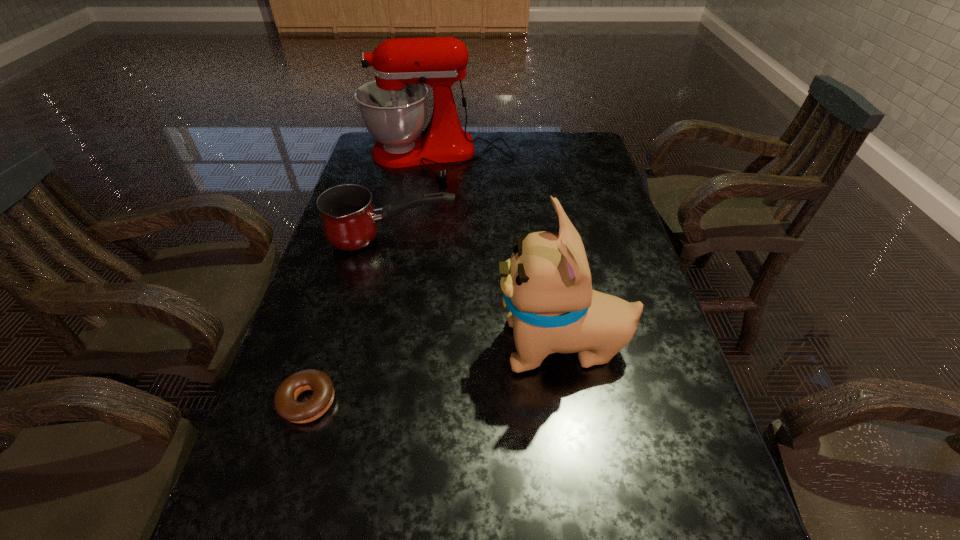
At what (x,y) coordinates should I click in order to perform the action: click on the farthest object. Please return your answer as a coordinate pair (x, y). The height and width of the screenshot is (540, 960). Looking at the image, I should click on pos(393,108).

In order to click on puppy in this screenshot , I will do `click(547, 287)`.

Locate an element on the screen. The height and width of the screenshot is (540, 960). the third tallest object is located at coordinates (350, 223).

Image resolution: width=960 pixels, height=540 pixels. Identify the location of saucepan. (350, 223).

Identify the location of doughnut. [x=286, y=406].

In order to click on vacant position located on the bowl side of the farthest object in this screenshot , I will do `click(423, 261)`.

Locate an element on the screen. This screenshot has width=960, height=540. blank space located 0.170m on the face of the puppy is located at coordinates (420, 346).

Image resolution: width=960 pixels, height=540 pixels. Find the location of `free region located 0.340m on the face of the puppy`. free region located 0.340m on the face of the puppy is located at coordinates (344, 346).

Locate an element on the screen. free space located 0.340m on the face of the puppy is located at coordinates [x=344, y=346].

You are a GUI agent. You are given a task and a screenshot of the screen. Output one action in this format:
    pyautogui.click(x=<x>, y=<y>)
    Task: Click on the vacant space situated on the handle side of the saucepan
    
    Given the screenshot: What is the action you would take?
    pyautogui.click(x=588, y=240)